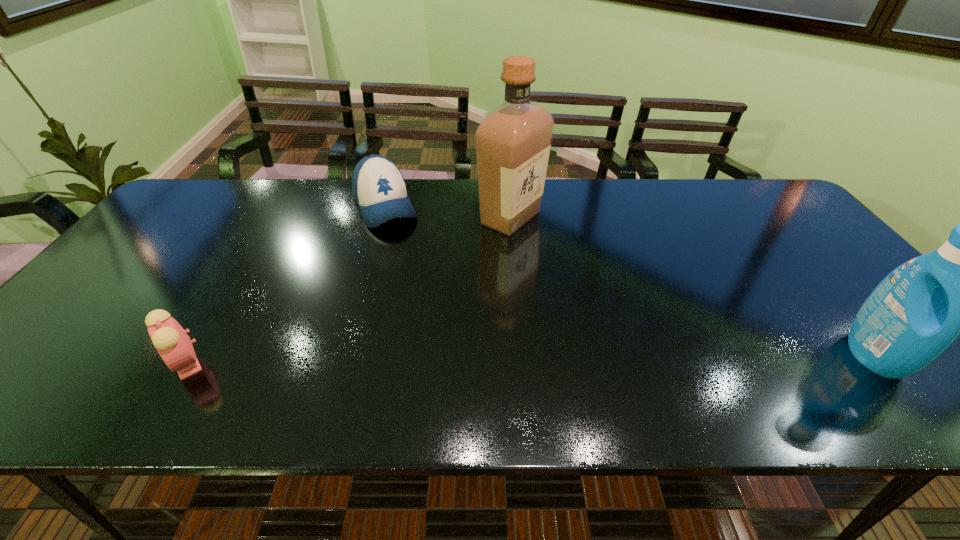
Where is `free spot on the desktop that is between the leftmost object and the detergent and is positioned on the front-facing side of the tallest object`? free spot on the desktop that is between the leftmost object and the detergent and is positioned on the front-facing side of the tallest object is located at coordinates (613, 358).

The height and width of the screenshot is (540, 960). I want to click on free space on the desktop that is between the leftmost object and the detergent and is positioned on the front-facing side of the third object from right to left, so click(465, 360).